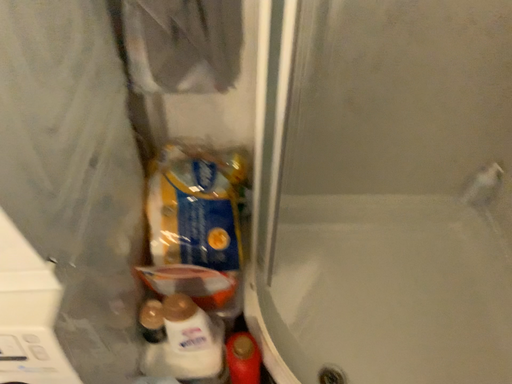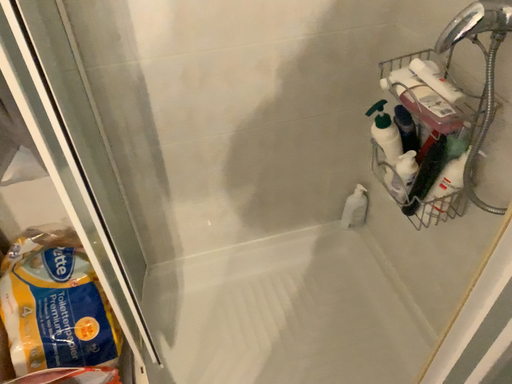
Question: Which way did the camera rotate in the video?

Choices:
 (A) rotated downward
 (B) rotated upward

Answer: (B)